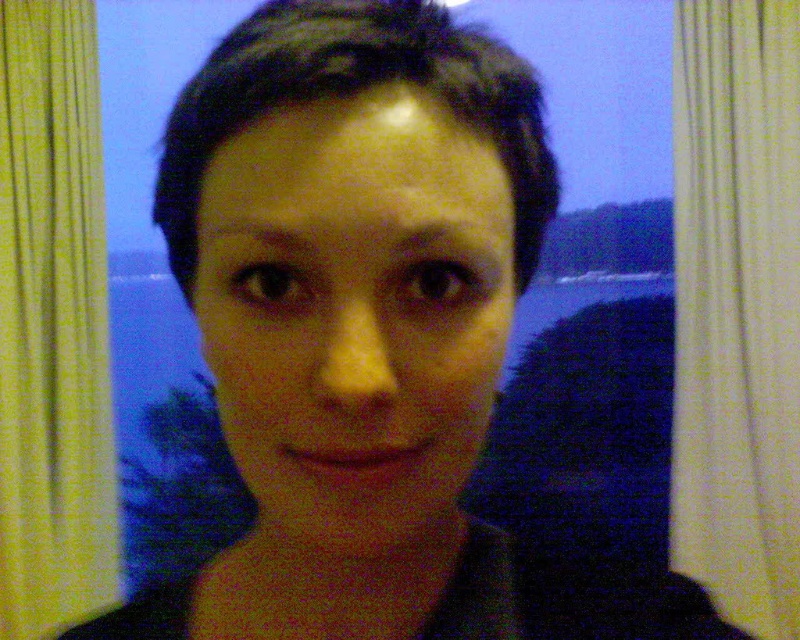
Question: Can you confirm if yellow fabric curtain at left is positioned below yellow textured curtain at left?

Choices:
 (A) no
 (B) yes

Answer: (B)

Question: Which of the following is the closest to the observer?

Choices:
 (A) (26, 385)
 (B) (722, 534)

Answer: (B)

Question: Which of the following is the farthest from the observer?

Choices:
 (A) (790, 604)
 (B) (76, 38)

Answer: (B)

Question: Does yellow fabric curtain at left appear under yellow textured curtain at left?

Choices:
 (A) no
 (B) yes

Answer: (B)

Question: In this image, where is yellow fabric curtain at left located relative to yellow textured curtain at left?

Choices:
 (A) right
 (B) left

Answer: (A)